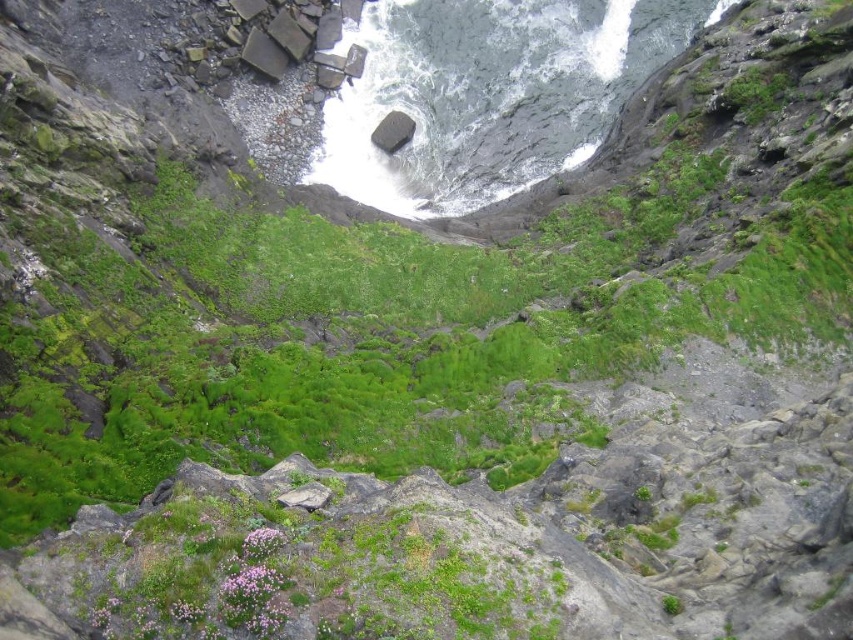
Consider the image. You are a hiker trying to cross the river shown in the image. You see the white frothy water at center and the smooth gray rock at center. Which one do you think is a safer place to step on?

The smooth gray rock at center is a safer place to step on because the white frothy water at center has a larger size and may indicate a stronger current, making it more dangerous.

You are standing at the camera position and want to reach the point marked at coordinates (538, 83) in the image. Given that the distance between them is 218.60 feet, will you need to traverse any rocky terrain or vegetation areas before reaching the point?

The point marked at coordinates (538, 83) is 218.60 feet away from the camera position. Since the path between them crosses rocky terrain and lush vegetation areas, you will need to traverse both rocky terrain and vegetation areas to reach the point.

You are a hiker trying to cross the river shown in the image. You see the white frothy water at center and the gray rough stone at center. Which one is closer to you as you approach the river?

The white frothy water at center is closer to you than the gray rough stone at center because it is further to the viewer.